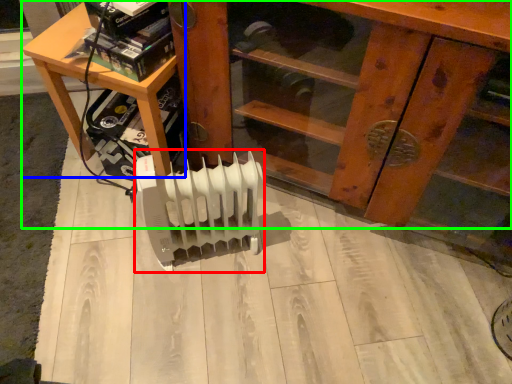
Question: Estimate the real-world distances between objects in this image. Which object is closer to heater (highlighted by a red box), table (highlighted by a blue box) or furniture (highlighted by a green box)?

Choices:
 (A) table
 (B) furniture

Answer: (A)